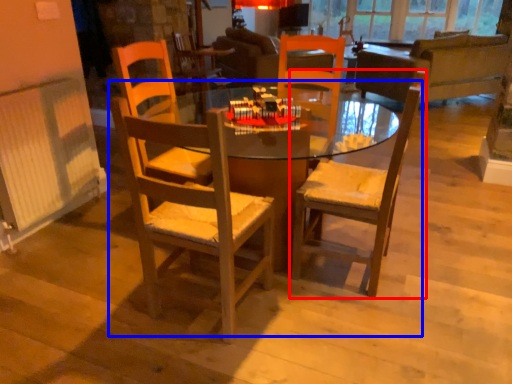
Question: Among these objects, which one is farthest to the camera, chair (highlighted by a red box) or kitchen & dining room table (highlighted by a blue box)?

Choices:
 (A) chair
 (B) kitchen & dining room table

Answer: (A)